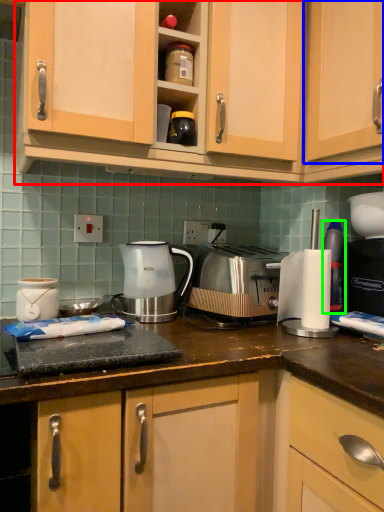
Question: Which object is positioned closest to cabinetry (highlighted by a red box)? Select from cabinetry (highlighted by a blue box) and bottle (highlighted by a green box).

Choices:
 (A) cabinetry
 (B) bottle

Answer: (A)